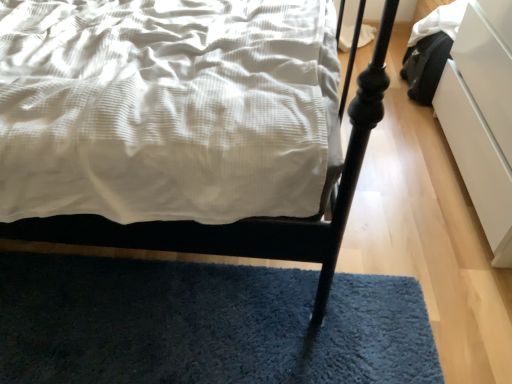
Locate an element on the screen. The height and width of the screenshot is (384, 512). vacant space situated above blue shaggy rug at lower center (from a real-world perspective) is located at coordinates coord(154,338).